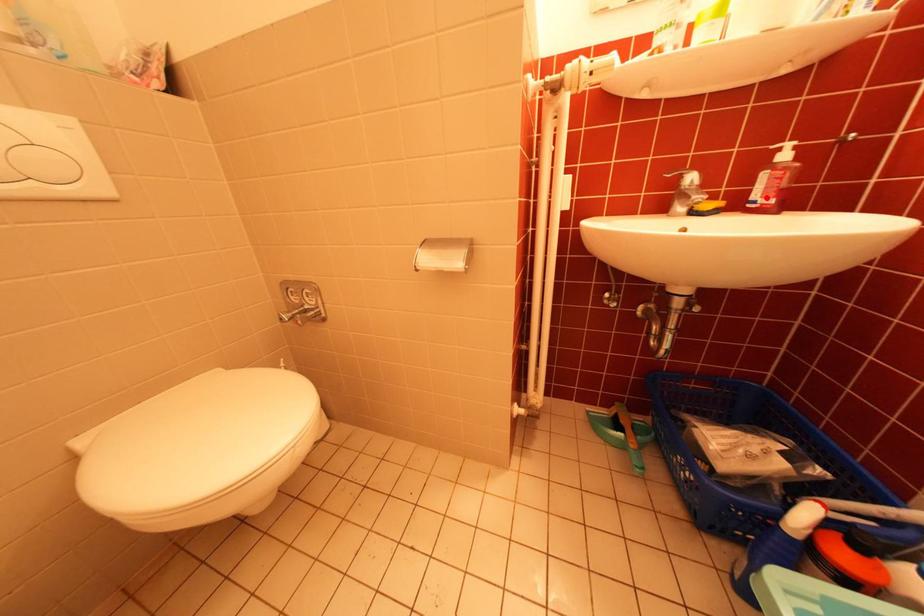
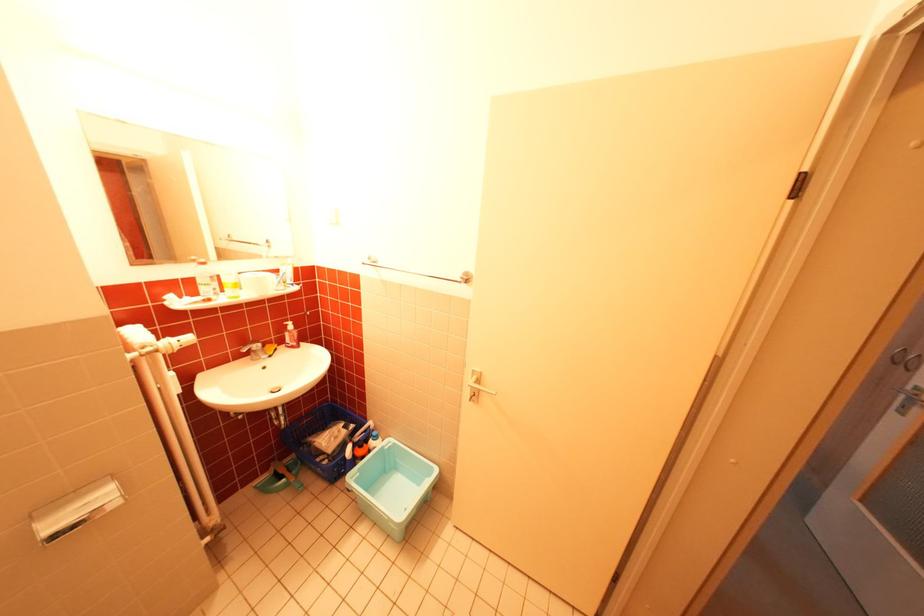
Find the pixel in the second image that matches the highlighted location in the first image.

(298, 342)